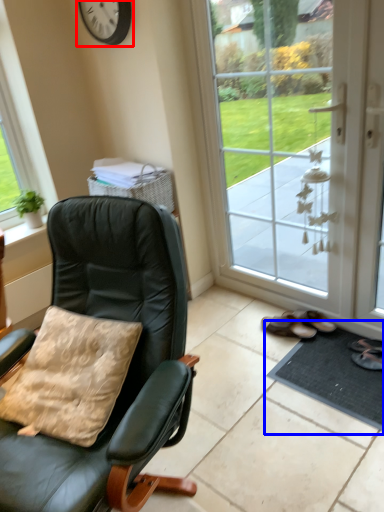
Question: Which point is further to the camera, clock (highlighted by a red box) or doormat (highlighted by a blue box)?

Choices:
 (A) clock
 (B) doormat

Answer: (A)